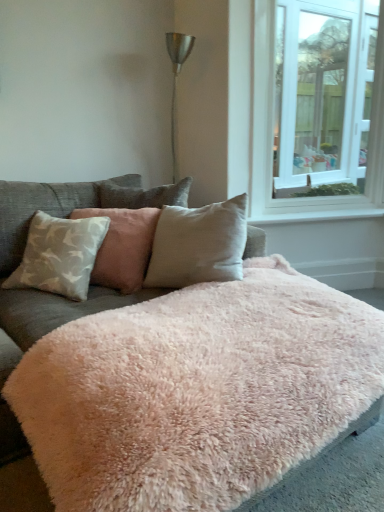
Question: Should I look upward or downward to see light beige fabric pillow at center, marked as the 1th pillow in a right-to-left arrangement?

Choices:
 (A) up
 (B) down

Answer: (A)

Question: Does light gray fabric pillow at left, which ranks as the second pillow in right-to-left order, have a smaller size compared to white glass window at upper right?

Choices:
 (A) yes
 (B) no

Answer: (A)

Question: Are light gray fabric pillow at left, which ranks as the second pillow in right-to-left order, and white glass window at upper right beside each other?

Choices:
 (A) no
 (B) yes

Answer: (A)

Question: From a real-world perspective, is light gray fabric pillow at left, which ranks as the second pillow in right-to-left order, below white glass window at upper right?

Choices:
 (A) no
 (B) yes

Answer: (B)

Question: Is the depth of light gray fabric pillow at left, the first pillow positioned from the left, greater than that of white glass window at upper right?

Choices:
 (A) yes
 (B) no

Answer: (B)

Question: From the image's perspective, is light gray fabric pillow at left, which ranks as the second pillow in right-to-left order, on white glass window at upper right?

Choices:
 (A) no
 (B) yes

Answer: (A)

Question: Can white glass window at upper right be found inside light gray fabric pillow at left, the first pillow positioned from the left?

Choices:
 (A) no
 (B) yes

Answer: (A)

Question: Are white glass window at upper right and light beige fabric pillow at center, which is the 2th pillow in left-to-right order, making contact?

Choices:
 (A) no
 (B) yes

Answer: (A)

Question: Does white glass window at upper right contain light beige fabric pillow at center, which is the 2th pillow in left-to-right order?

Choices:
 (A) no
 (B) yes

Answer: (A)

Question: From the image's perspective, would you say white glass window at upper right is positioned over light beige fabric pillow at center, marked as the 1th pillow in a right-to-left arrangement?

Choices:
 (A) no
 (B) yes

Answer: (B)

Question: Is white glass window at upper right far from light beige fabric pillow at center, marked as the 1th pillow in a right-to-left arrangement?

Choices:
 (A) no
 (B) yes

Answer: (B)

Question: Is white glass window at upper right at the left side of light beige fabric pillow at center, marked as the 1th pillow in a right-to-left arrangement?

Choices:
 (A) yes
 (B) no

Answer: (B)

Question: Is white glass window at upper right taller than light beige fabric pillow at center, marked as the 1th pillow in a right-to-left arrangement?

Choices:
 (A) no
 (B) yes

Answer: (B)

Question: Is white smooth window sill at upper right oriented towards light beige fabric pillow at center, marked as the 1th pillow in a right-to-left arrangement?

Choices:
 (A) no
 (B) yes

Answer: (A)